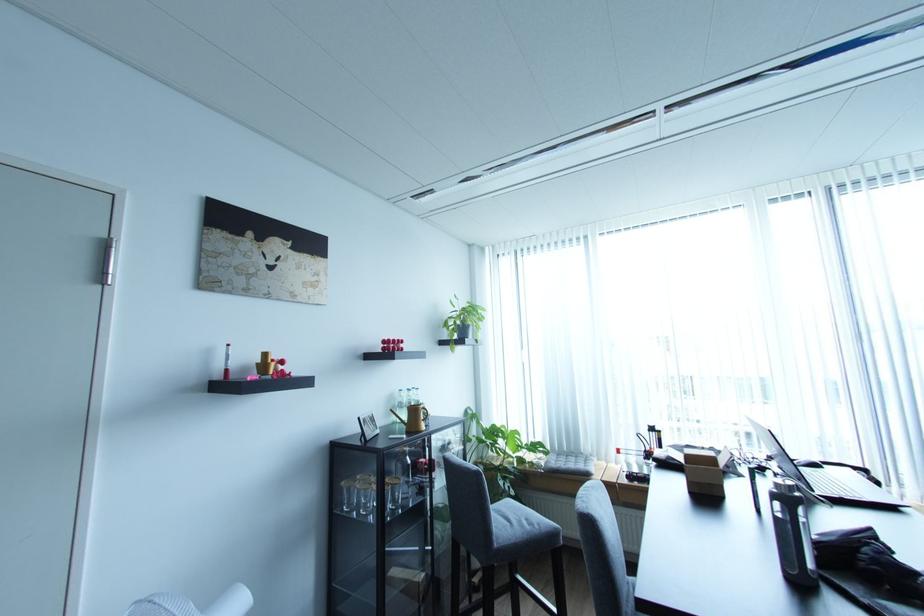
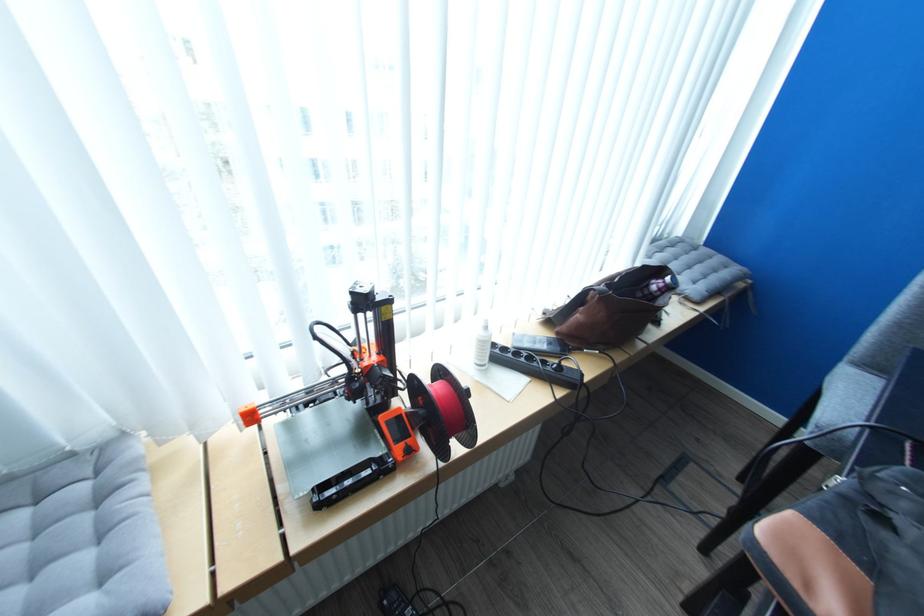
Where in the second image is the point corresponding to (x=594, y=456) from the first image?

(124, 436)